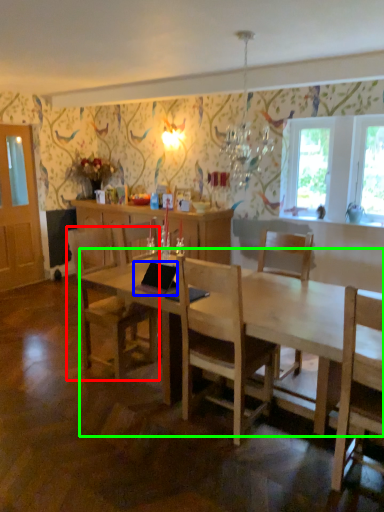
Question: Estimate the real-world distances between objects in this image. Which object is farther from chair (highlighted by a red box), laptop (highlighted by a blue box) or desk (highlighted by a green box)?

Choices:
 (A) laptop
 (B) desk

Answer: (B)